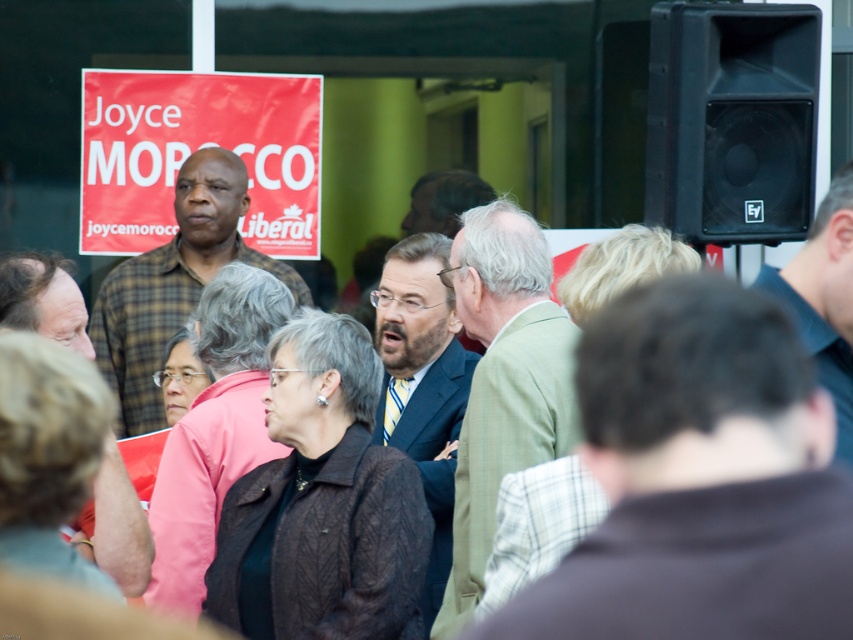
You are a photographer at a political rally. You have a camera with a 3.5 meter focal length. You want to capture both the black plastic speaker at upper right and the red plastic sign at center in the same frame. Is this possible?

The black plastic speaker at upper right and the red plastic sign at center are 4.49 meters apart from each other. Since the camera has a 3.5 meter focal length, which is shorter than the distance between them, it might be challenging to fit both in the same frame. Adjusting your position or using a wider lens could help, but based on the given focal length, capturing both might not be feasible.

You are at a political rally and need to locate both the black plastic speaker at upper right and the red plastic sign at center. From your vantage point, which object is positioned lower?

The black plastic speaker at upper right is positioned below the red plastic sign at center, so it is lower.